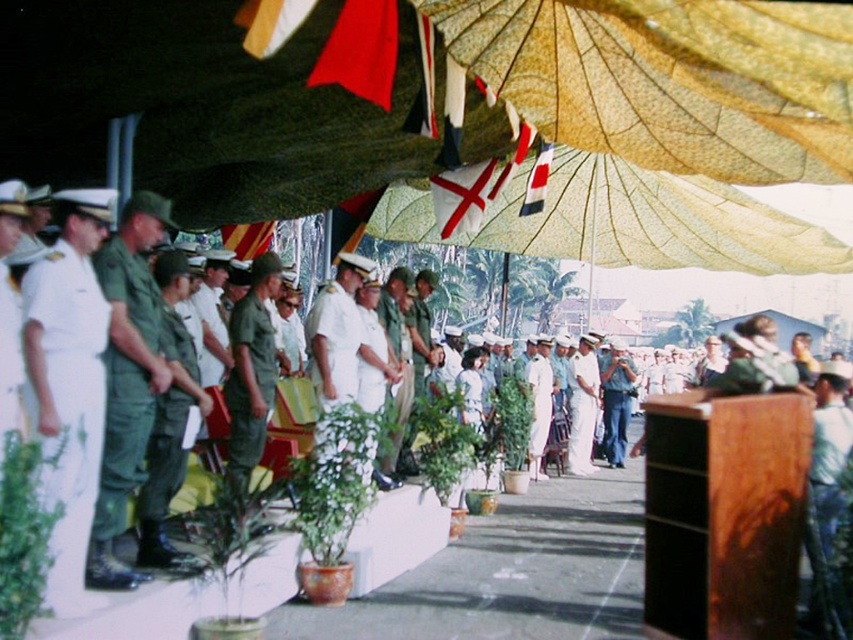
Between green fabric uniform at left and white matte uniform at center, which one has more height?

Standing taller between the two is white matte uniform at center.

Locate an element on the screen. Image resolution: width=853 pixels, height=640 pixels. green fabric uniform at left is located at coordinates (170, 422).

Is white cotton shirt at center shorter than denim pants at center?

In fact, white cotton shirt at center may be taller than denim pants at center.

The height and width of the screenshot is (640, 853). I want to click on white cotton shirt at center, so click(x=582, y=406).

Between point (589, 433) and point (624, 444), which one is positioned in front?

Point (589, 433) is more forward.

This screenshot has width=853, height=640. I want to click on white cotton shirt at center, so click(x=582, y=406).

Does yellow fabric umbrella at center have a lesser height compared to green matte uniform at center?

No, yellow fabric umbrella at center is not shorter than green matte uniform at center.

What do you see at coordinates (624, 221) in the screenshot?
I see `yellow fabric umbrella at center` at bounding box center [624, 221].

Does point (613, 198) come in front of point (247, 321)?

No, (613, 198) is behind (247, 321).

Locate an element on the screen. The height and width of the screenshot is (640, 853). yellow fabric umbrella at center is located at coordinates [x=624, y=221].